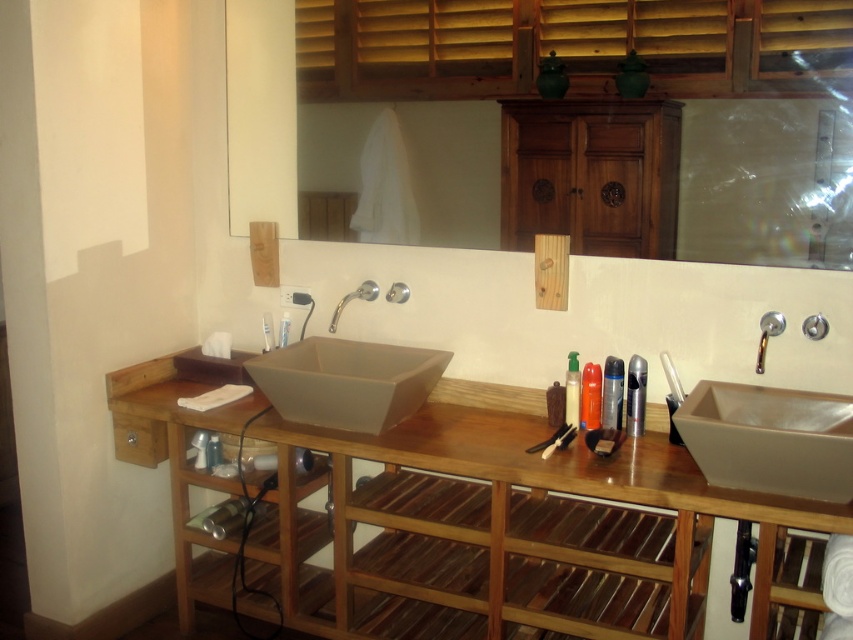
Question: Which of the following is the farthest from the observer?

Choices:
 (A) wooden vanity at center
 (B) silver metallic faucet at center
 (C) silver metallic faucet at upper right

Answer: (B)

Question: Which of these objects is positioned farthest from the matte beige sink at right?

Choices:
 (A) wooden comb at center
 (B) wooden cabinet at upper center

Answer: (B)

Question: Does wooden vanity at center have a lesser width compared to wooden comb at center?

Choices:
 (A) no
 (B) yes

Answer: (A)

Question: Estimate the real-world distances between objects in this image. Which object is farther from the silver metallic faucet at upper right?

Choices:
 (A) matte beige sink at center
 (B) wooden vanity at center
 (C) silver metallic faucet at center

Answer: (C)

Question: Observing the image, what is the correct spatial positioning of matte beige sink at right in reference to matte beige sink at center?

Choices:
 (A) left
 (B) right

Answer: (B)

Question: Considering the relative positions of wooden vanity at center and wooden comb at center in the image provided, where is wooden vanity at center located with respect to wooden comb at center?

Choices:
 (A) left
 (B) right

Answer: (A)